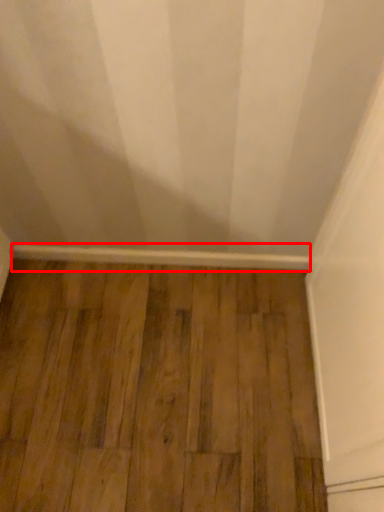
Question: From the image's perspective, where is molding (annotated by the red box) located in relation to hardwood in the image?

Choices:
 (A) below
 (B) above

Answer: (B)